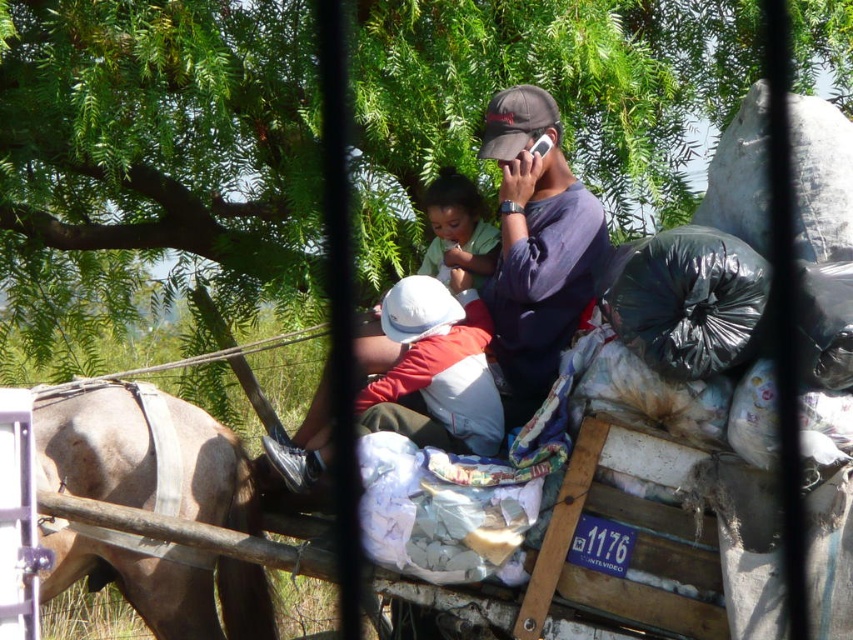
You are a delivery person who needs to place a rectangular box on the cart. The box is 1.2 meters wide. You see the dark blue fabric at center and the soft white cloth at center. Which one can you place the box on without exceeding its width?

The dark blue fabric at center has a greater width than the soft white cloth at center. Since the box is 1.2 meters wide, you should place it on the dark blue fabric at center if its width is sufficient to accommodate the box. However, the exact width measurements are not provided, so this answer assumes the dark blue fabric is wider than the soft white cloth but may not confirm if it meets the 1.2 meter requirement.

You are a photographer trying to capture the horse and cart scene. You notice the brown leather harness at left and the soft white cloth at center. Which object should you focus on if you want to highlight something taller in your photo?

The brown leather harness at left is taller than the soft white cloth at center, so focusing on it would highlight the taller object.